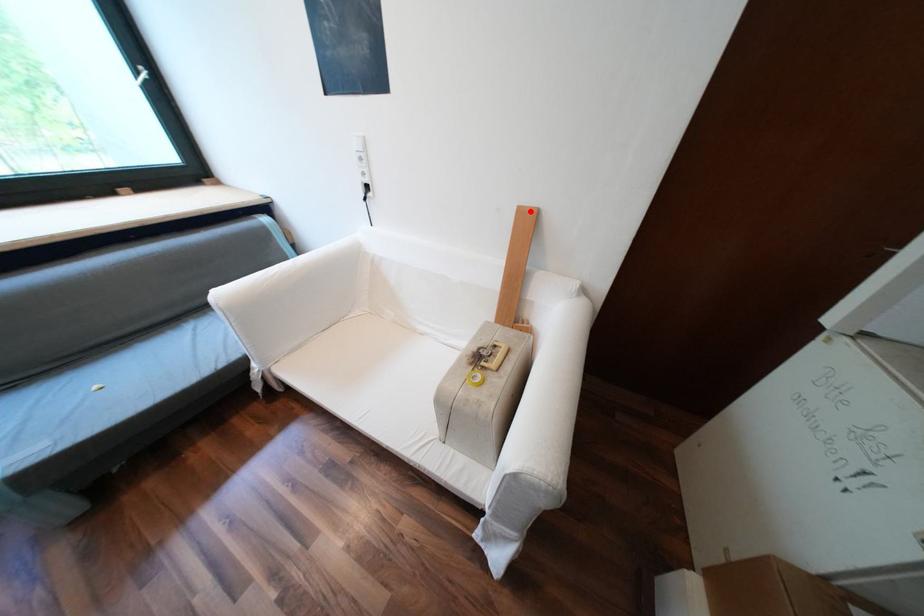
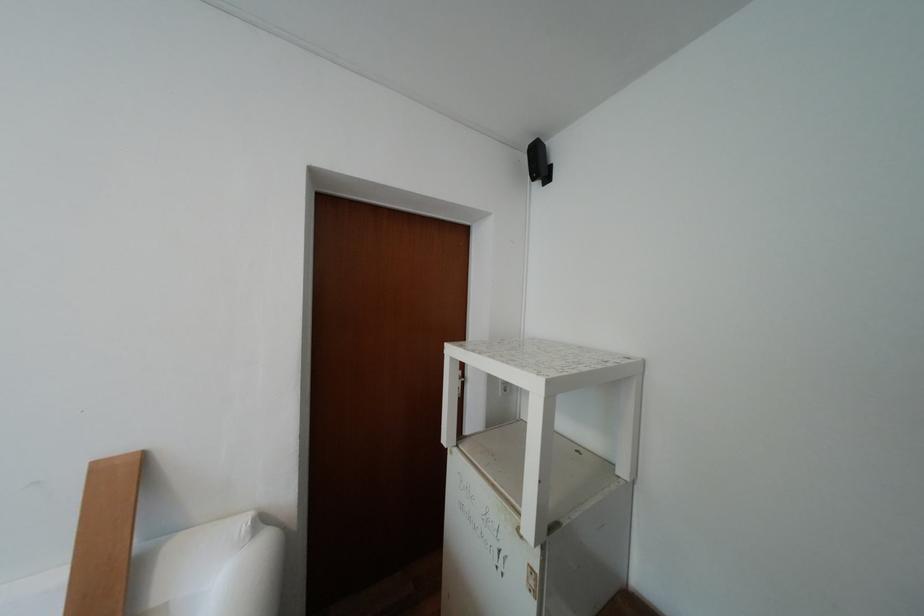
In the second image, find the point that corresponds to the highlighted location in the first image.

(111, 468)